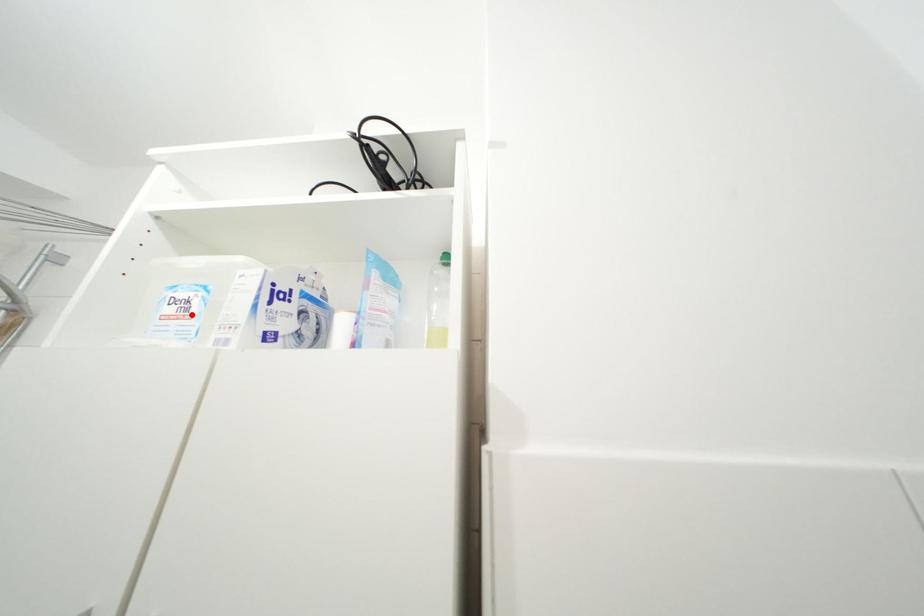
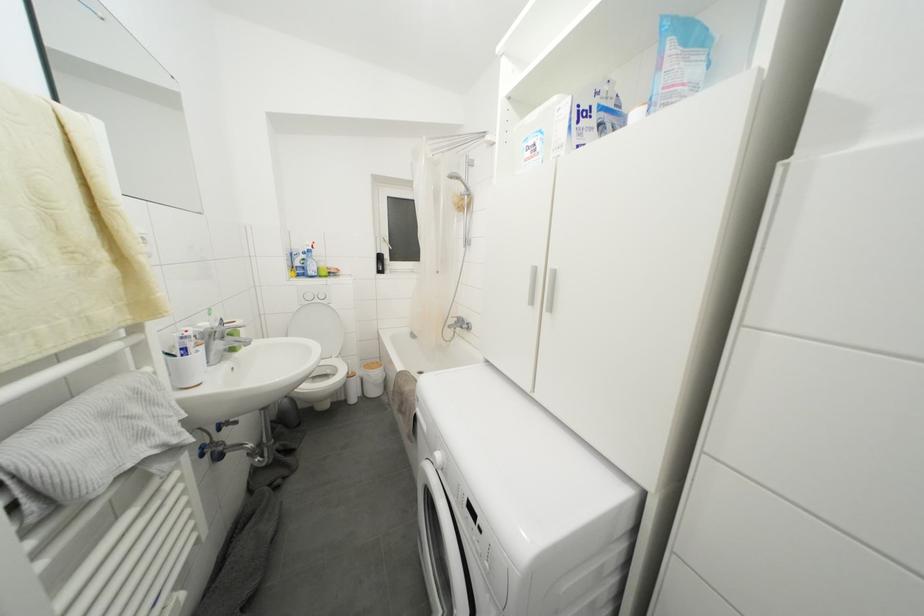
Find the pixel in the second image that matches the highlighted location in the first image.

(540, 155)